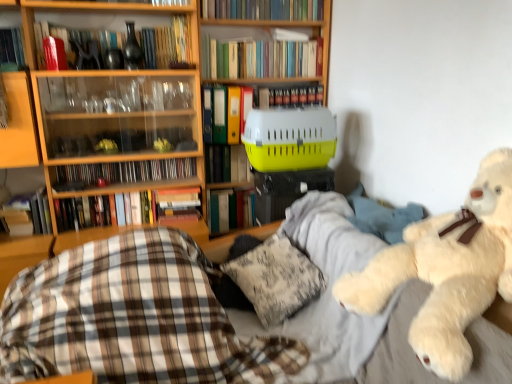
Question: Is hardcover books at upper center, the seventh book ordered from the bottom, aimed at matte black cd case at upper left, arranged as the sixth book when viewed from the top?

Choices:
 (A) yes
 (B) no

Answer: (B)

Question: Can we say hardcover books at upper center, the seventh book ordered from the bottom, lies outside matte black cd case at upper left, the 4th book when ordered from bottom to top?

Choices:
 (A) yes
 (B) no

Answer: (A)

Question: Does hardcover books at upper center, positioned as the third book in top-to-bottom order, have a greater height compared to matte black cd case at upper left, arranged as the sixth book when viewed from the top?

Choices:
 (A) yes
 (B) no

Answer: (A)

Question: Is hardcover books at upper center, positioned as the third book in top-to-bottom order, touching matte black cd case at upper left, the 4th book when ordered from bottom to top?

Choices:
 (A) no
 (B) yes

Answer: (A)

Question: Is hardcover books at upper center, the seventh book ordered from the bottom, at the right side of matte black cd case at upper left, arranged as the sixth book when viewed from the top?

Choices:
 (A) yes
 (B) no

Answer: (A)

Question: Considering the relative sizes of hardcover books at upper center, positioned as the third book in top-to-bottom order, and matte black cd case at upper left, the 4th book when ordered from bottom to top, in the image provided, is hardcover books at upper center, positioned as the third book in top-to-bottom order, wider than matte black cd case at upper left, the 4th book when ordered from bottom to top,?

Choices:
 (A) no
 (B) yes

Answer: (B)

Question: Is fluffy white teddy bear at right behind yellow plastic pet carrier at center?

Choices:
 (A) no
 (B) yes

Answer: (A)

Question: From the image's perspective, would you say fluffy white teddy bear at right is positioned over yellow plastic pet carrier at center?

Choices:
 (A) no
 (B) yes

Answer: (A)

Question: Is fluffy white teddy bear at right smaller than yellow plastic pet carrier at center?

Choices:
 (A) no
 (B) yes

Answer: (B)

Question: Is fluffy white teddy bear at right facing towards yellow plastic pet carrier at center?

Choices:
 (A) no
 (B) yes

Answer: (A)

Question: From the image's perspective, is fluffy white teddy bear at right located beneath yellow plastic pet carrier at center?

Choices:
 (A) yes
 (B) no

Answer: (A)

Question: Considering the relative sizes of fluffy white teddy bear at right and yellow plastic pet carrier at center in the image provided, is fluffy white teddy bear at right shorter than yellow plastic pet carrier at center?

Choices:
 (A) no
 (B) yes

Answer: (B)

Question: Is wooden bookcase at upper left next to yellow plastic crate at center, which is the fifth book from top to bottom, and touching it?

Choices:
 (A) yes
 (B) no

Answer: (B)